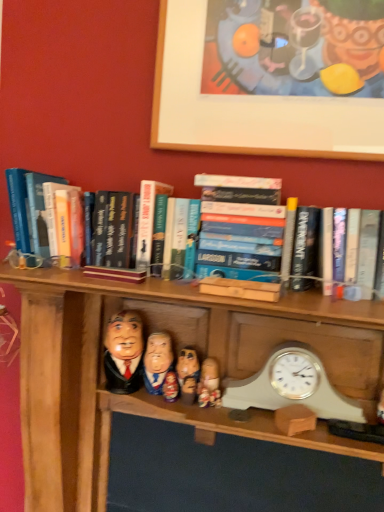
Question: Considering the relative sizes of wooden figurine at center, which is counted as the first person, starting from the right, and wooden figurine at center, the second person positioned from the left, in the image provided, is wooden figurine at center, which is counted as the first person, starting from the right, shorter than wooden figurine at center, the second person positioned from the left,?

Choices:
 (A) yes
 (B) no

Answer: (A)

Question: Is wooden figurine at center, the second person positioned from the left, a part of wooden figurine at center, which is counted as the first person, starting from the right?

Choices:
 (A) no
 (B) yes

Answer: (A)

Question: Is wooden figurine at center, which is counted as the first person, starting from the right, not within wooden figurine at center, the second person positioned from the left?

Choices:
 (A) yes
 (B) no

Answer: (A)

Question: Is wooden figurine at center, acting as the fourth person starting from the left, looking in the opposite direction of wooden figurine at center, placed as the 3th person when sorted from right to left?

Choices:
 (A) no
 (B) yes

Answer: (A)

Question: Considering the relative sizes of wooden figurine at center, acting as the fourth person starting from the left, and wooden figurine at center, placed as the 3th person when sorted from right to left, in the image provided, is wooden figurine at center, acting as the fourth person starting from the left, taller than wooden figurine at center, placed as the 3th person when sorted from right to left,?

Choices:
 (A) no
 (B) yes

Answer: (A)

Question: From the image's perspective, is wooden picture frame at upper center positioned above or below wooden doll at center, which is the 3th toy in right-to-left order?

Choices:
 (A) below
 (B) above

Answer: (B)

Question: Is wooden picture frame at upper center inside the boundaries of wooden doll at center, which is the 3th toy in right-to-left order, or outside?

Choices:
 (A) inside
 (B) outside

Answer: (B)

Question: In the image, is wooden picture frame at upper center on the left side or the right side of wooden doll at center, which is the 3th toy in right-to-left order?

Choices:
 (A) right
 (B) left

Answer: (A)

Question: Is wooden picture frame at upper center in front of or behind wooden doll at center, which is the 3th toy in right-to-left order, in the image?

Choices:
 (A) front
 (B) behind

Answer: (A)

Question: Does point (215, 104) appear closer or farther from the camera than point (183, 394)?

Choices:
 (A) farther
 (B) closer

Answer: (A)

Question: From a real-world perspective, is wooden picture frame at upper center above or below wooden figurine at center, the 2th toy positioned from the left?

Choices:
 (A) below
 (B) above

Answer: (B)

Question: From the image's perspective, is wooden picture frame at upper center positioned above or below wooden figurine at center, arranged as the second toy when viewed from the right?

Choices:
 (A) above
 (B) below

Answer: (A)

Question: Considering the relative positions of wooden picture frame at upper center and wooden figurine at center, arranged as the second toy when viewed from the right, in the image provided, is wooden picture frame at upper center to the left or to the right of wooden figurine at center, arranged as the second toy when viewed from the right,?

Choices:
 (A) left
 (B) right

Answer: (B)

Question: Choose the correct answer: Is white plastic clock at lower right inside wooden figurine at center, placed as the 3th person when sorted from right to left, or outside it?

Choices:
 (A) inside
 (B) outside

Answer: (B)

Question: Considering the positions of white plastic clock at lower right and wooden figurine at center, placed as the 3th person when sorted from right to left, in the image, is white plastic clock at lower right taller or shorter than wooden figurine at center, placed as the 3th person when sorted from right to left,?

Choices:
 (A) short
 (B) tall

Answer: (B)